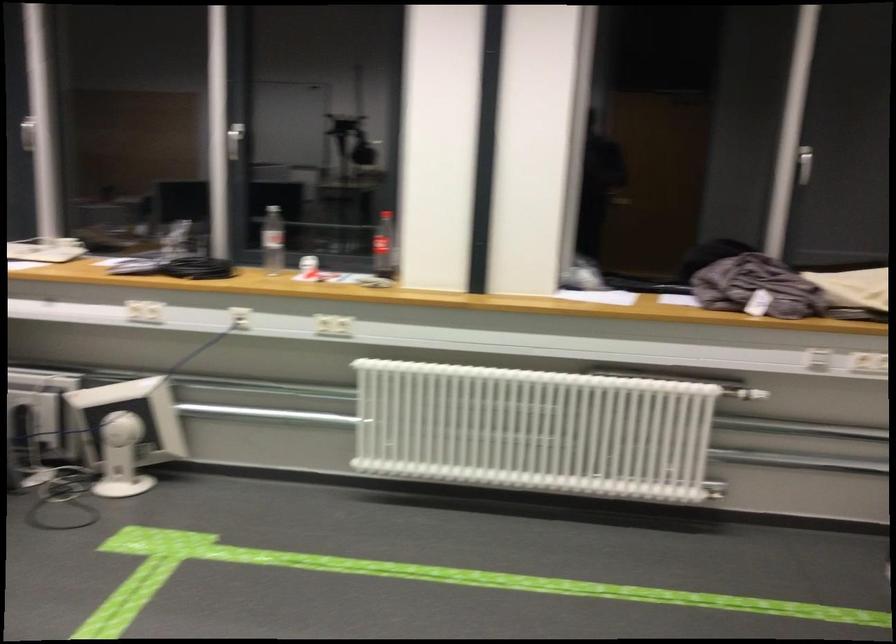
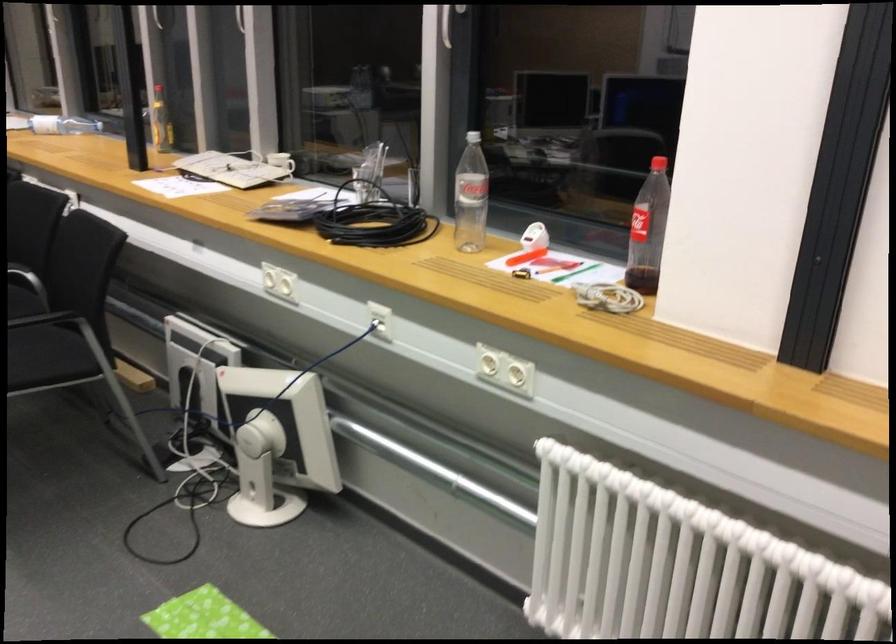
Locate, in the second image, the point that corresponds to point (313, 279) in the first image.

(524, 256)